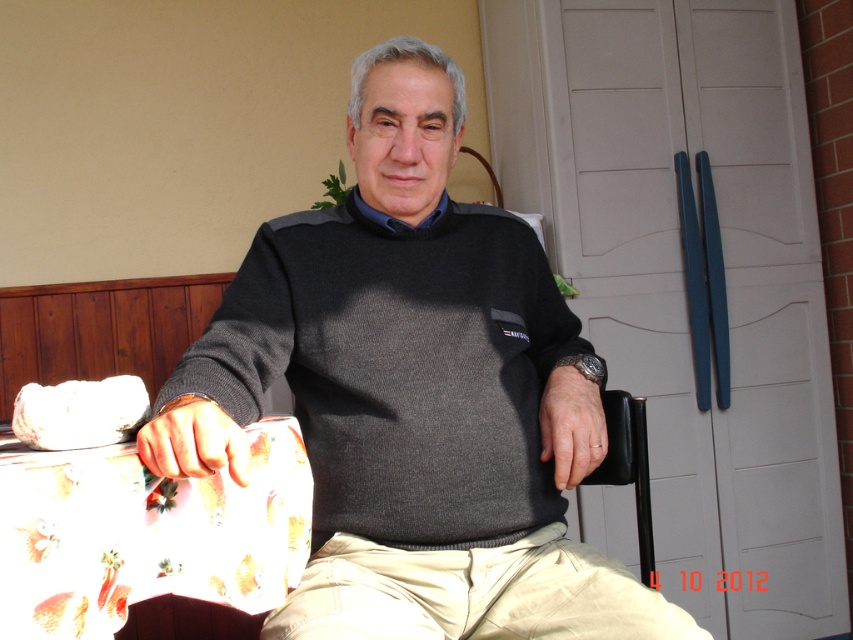
Question: Where is dark gray sweater at center located in relation to black plastic chair at lower right in the image?

Choices:
 (A) right
 (B) left

Answer: (B)

Question: Is dark gray sweater at center positioned before black plastic chair at lower right?

Choices:
 (A) yes
 (B) no

Answer: (A)

Question: Which object appears closest to the camera in this image?

Choices:
 (A) khaki cotton pants at lower center
 (B) black plastic chair at lower right

Answer: (A)

Question: Among these points, which one is nearest to the camera?

Choices:
 (A) (537, 538)
 (B) (479, 577)
 (C) (599, 465)

Answer: (B)

Question: Is khaki cotton pants at lower center positioned behind black plastic chair at lower right?

Choices:
 (A) no
 (B) yes

Answer: (A)

Question: Considering the real-world distances, which object is farthest from the dark gray sweater at center?

Choices:
 (A) khaki cotton pants at lower center
 (B) black plastic chair at lower right

Answer: (B)